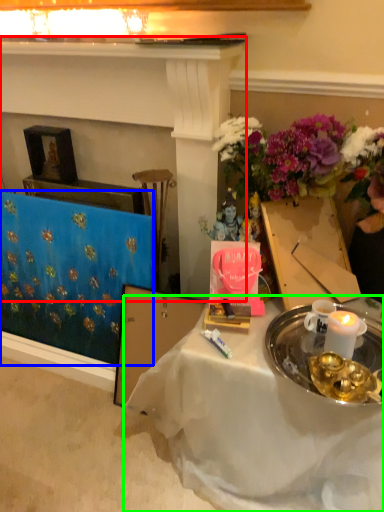
Question: Considering the real-world distances, which object is farthest from fireplace (highlighted by a red box)? tablecloth (highlighted by a blue box) or desk (highlighted by a green box)?

Choices:
 (A) tablecloth
 (B) desk

Answer: (B)